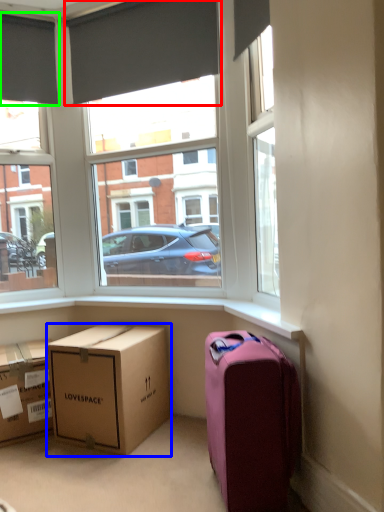
Question: Estimate the real-world distances between objects in this image. Which object is farther from curtain (highlighted by a red box), box (highlighted by a blue box) or curtain (highlighted by a green box)?

Choices:
 (A) box
 (B) curtain

Answer: (A)